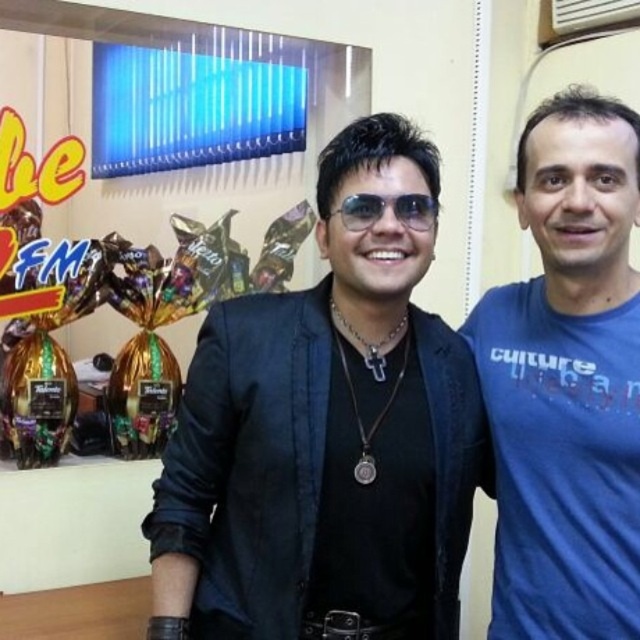
You are a photographer setting up for a photoshoot. You notice the black leather jacket at center and the sunglasses at center in the scene. Which object is positioned lower in the frame?

The black leather jacket at center is located below the sunglasses at center, so it is positioned lower in the frame.